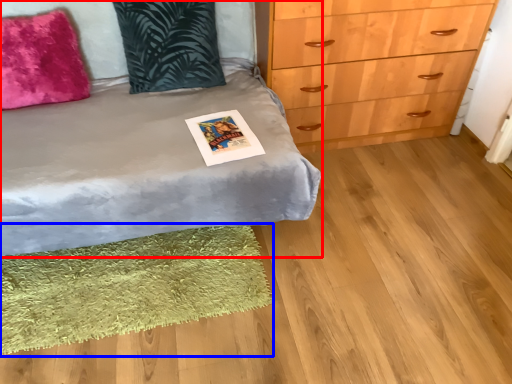
Question: Among these objects, which one is farthest to the camera, bed (highlighted by a red box) or mat (highlighted by a blue box)?

Choices:
 (A) bed
 (B) mat

Answer: (B)